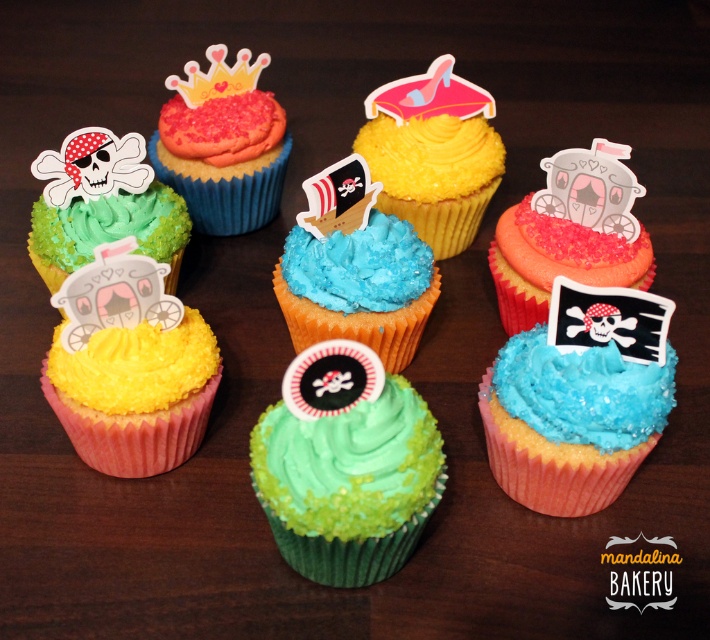
How much distance is there between blue sugar-coated cupcake at center and yellow sugared cupcake at center-left?

blue sugar-coated cupcake at center and yellow sugared cupcake at center-left are 10.60 inches apart from each other.

Describe the element at coordinates (355, 269) in the screenshot. This screenshot has height=640, width=710. I see `blue sugar-coated cupcake at center` at that location.

Find the location of a particular element. The width and height of the screenshot is (710, 640). blue sugar-coated cupcake at center is located at coordinates (355, 269).

At what (x,y) coordinates should I click in order to perform the action: click on yellow matte cupcake at center. Please return your answer as a coordinate pair (x, y). Looking at the image, I should click on (432, 154).

Is yellow matte cupcake at center to the right of matte pink cupcake with carriage at center from the viewer's perspective?

In fact, yellow matte cupcake at center is to the left of matte pink cupcake with carriage at center.

What are the coordinates of `yellow matte cupcake at center` in the screenshot? It's located at (432, 154).

Is smooth red frosting at center smaller than pastel pink paper carriage at upper center?

Incorrect, smooth red frosting at center is not smaller in size than pastel pink paper carriage at upper center.

Does smooth red frosting at center appear on the right side of pastel pink paper carriage at upper center?

Incorrect, smooth red frosting at center is not on the right side of pastel pink paper carriage at upper center.

Who is more distant from viewer, (207, 113) or (579, 152)?

The point (207, 113) is behind.

You are a GUI agent. You are given a task and a screenshot of the screen. Output one action in this format:
    pyautogui.click(x=<x>, y=<y>)
    Task: Click on the smooth red frosting at center
    Image resolution: width=710 pixels, height=640 pixels.
    Given the screenshot: What is the action you would take?
    pyautogui.click(x=222, y=145)